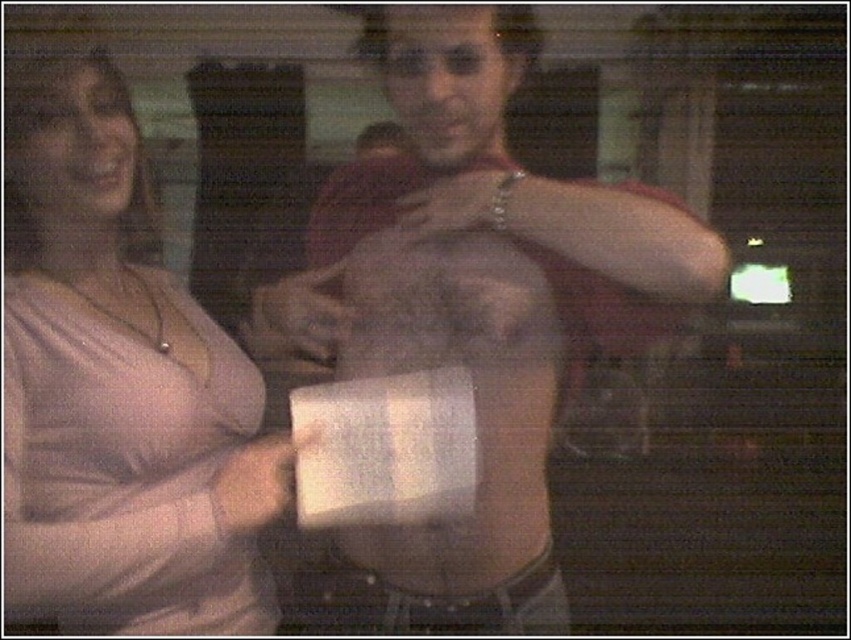
You are a photographer trying to capture a clear photo of the white matte paper at center. The pink matte shirt at left is blocking part of the view. Can you move closer to the paper to avoid the obstruction?

The pink matte shirt at left and white matte paper at center are 19.70 centimeters apart from each other. Moving closer to the white matte paper at center would reduce the distance between you and the paper, potentially allowing you to position yourself in a way that the pink matte shirt at left no longer blocks the view. However, since the objects themselves are only 19.70 cm apart, physical proximity might still result in some obstruction depending on your angle and positioning.

You are a photographer trying to capture a closeup of the white matte paper at center and the smooth skin hand at center in this nighttime scene. Based on their positions, which object is closer to the left edge of the frame?

The white matte paper at center is positioned on the left side of the smooth skin hand at center, so the white matte paper at center is closer to the left edge of the frame.

Based on the photo, you are trying to decide which shirt to wear for an event. You have a matte gray shirt at center and a pink matte shirt at left. Based on the image, which shirt would you choose if you want something that looks bigger on you?

The matte gray shirt at center is larger in size compared to the pink matte shirt at left, so you should choose the matte gray shirt at center if you want something that looks bigger on you.